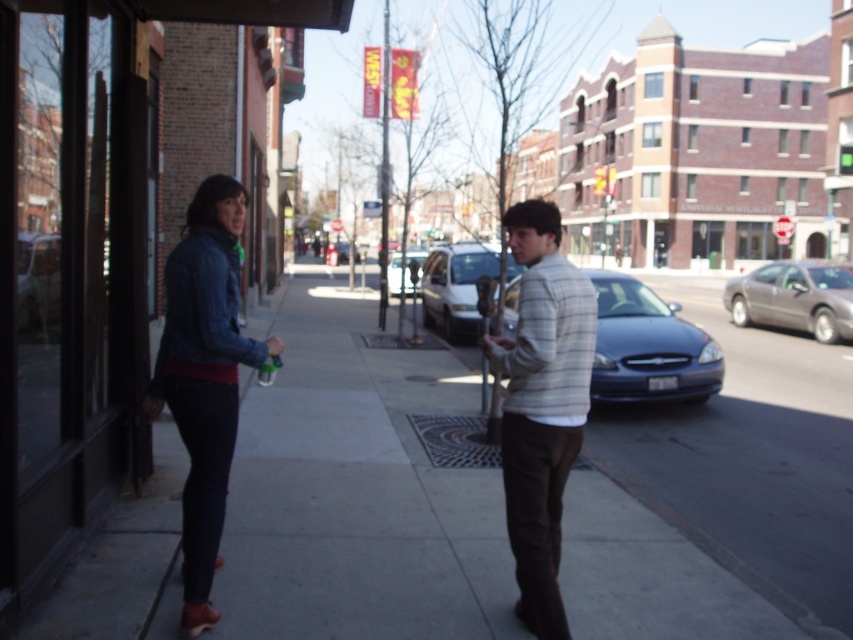
Question: Which object is positioned closest to the metallic gray sedan at right?

Choices:
 (A) gray concrete sidewalk at center
 (B) striped cotton shirt at center
 (C) white matte van at center

Answer: (C)

Question: In this image, where is white matte van at center located relative to metallic silver sedan at center?

Choices:
 (A) right
 (B) left

Answer: (A)

Question: Is denim jacket at center to the right of striped cotton shirt at center from the viewer's perspective?

Choices:
 (A) no
 (B) yes

Answer: (A)

Question: Based on their relative distances, which object is farther from the metallic silver sedan at center?

Choices:
 (A) striped cotton shirt at center
 (B) metallic gray sedan at right

Answer: (A)

Question: Is denim jacket at center smaller than metallic gray sedan at right?

Choices:
 (A) no
 (B) yes

Answer: (A)

Question: Which point is closer to the camera?

Choices:
 (A) white matte van at center
 (B) metallic gray sedan at right

Answer: (B)